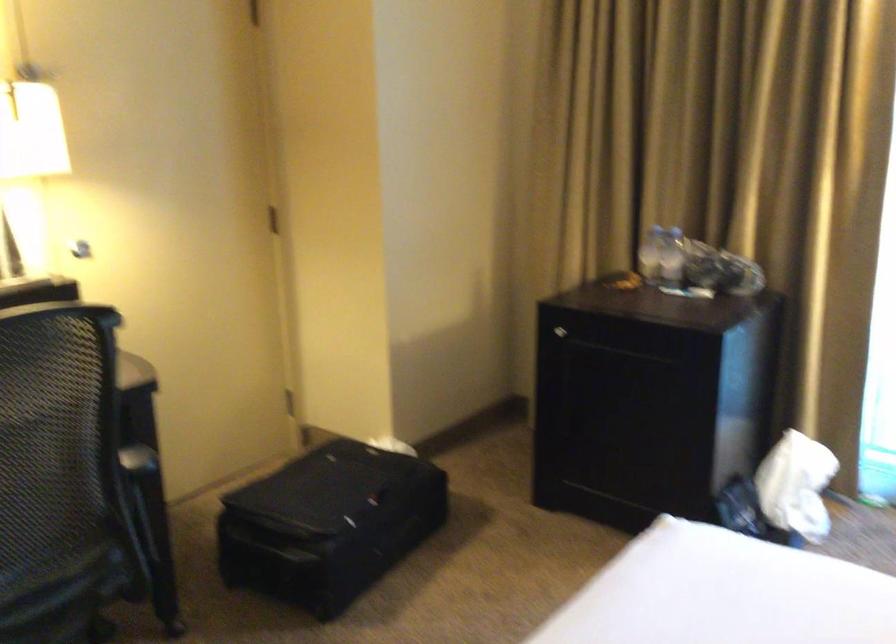
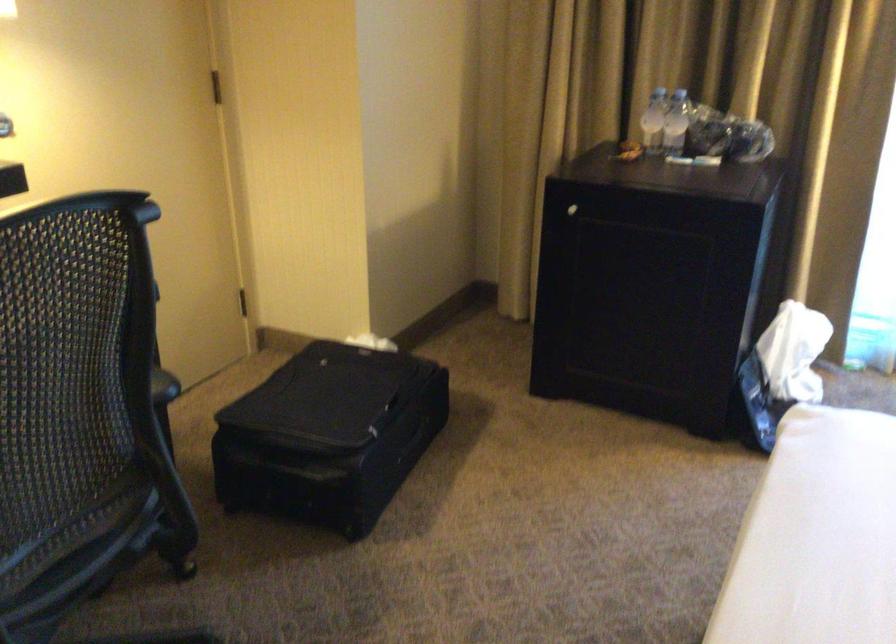
Locate, in the second image, the point that corresponds to point 314,522 in the first image.

(329, 436)